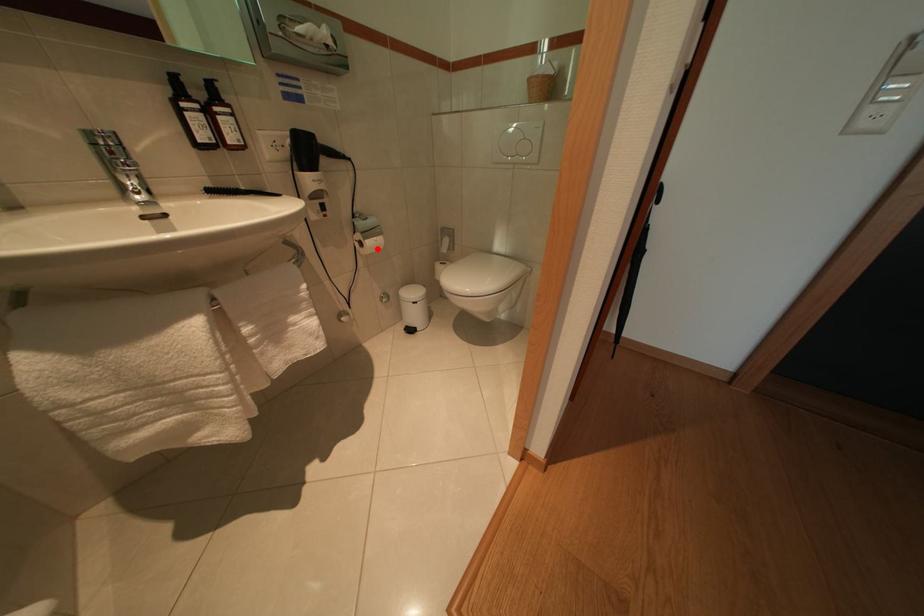
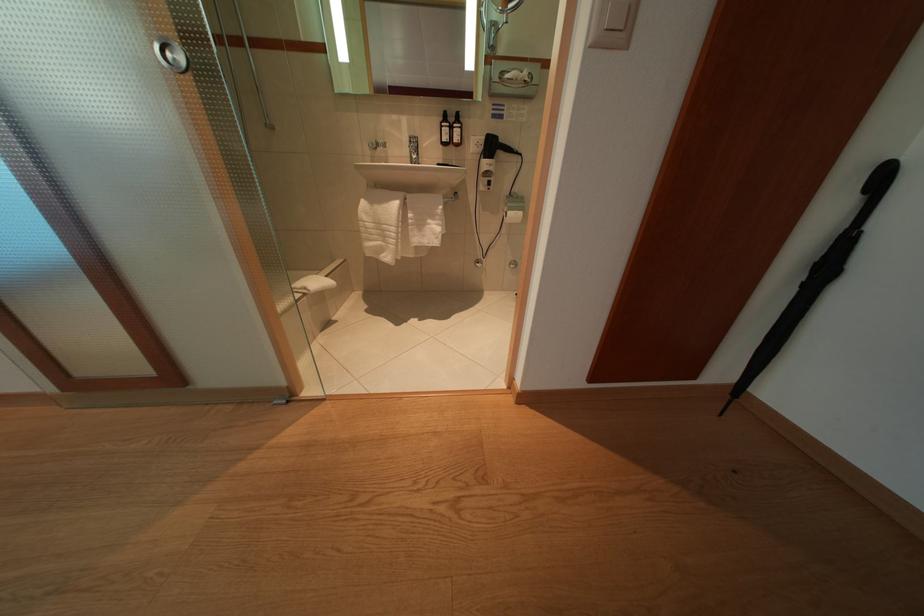
The point at the highlighted location is marked in the first image. Where is the corresponding point in the second image?

(517, 219)